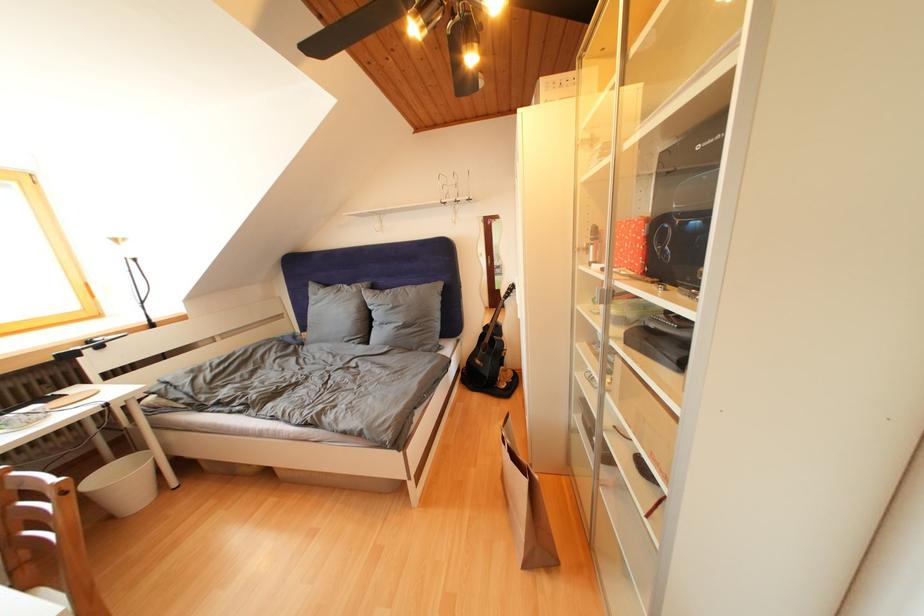
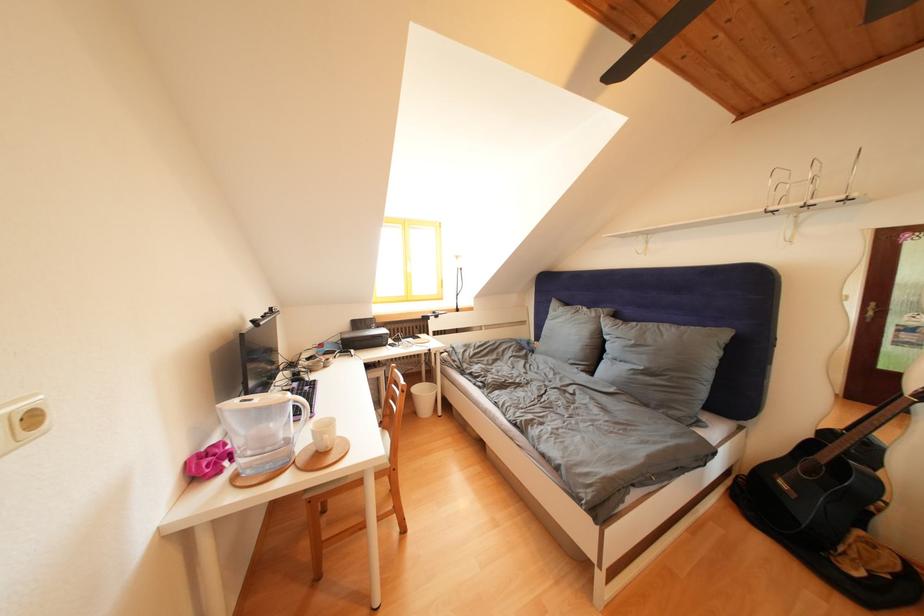
In the second image, find the point that corresponds to pixel 334 291 in the first image.

(575, 310)